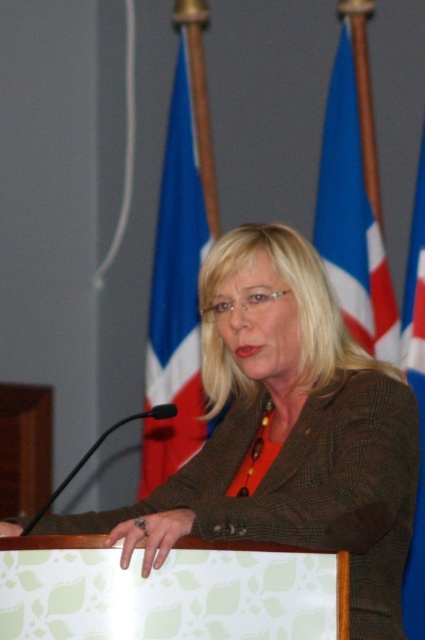
You are a photographer at the event and need to capture a clear shot of the brown textured blazer at center without the blue fabric flag at upper right blocking it. How can you adjust your position to achieve this?

Move closer to the brown textured blazer at center so that it is positioned between you and the blue fabric flag at upper right, ensuring the blazer blocks the view of the flag.

You are a photographer at the event and need to focus your camera on both the brown textured blazer at center and the blue fabric flag at upper right. Given their sizes, which one should you adjust your focus settings for first to ensure clarity?

The brown textured blazer at center has a larger size compared to the blue fabric flag at upper right, so you should focus on the brown textured blazer at center first to ensure clarity due to its larger size.

You are a photographer positioned at a certain distance from the podium. You want to capture a closeup shot of the brown textured blazer at center without moving the camera. Is the current distance sufficient to ensure the blazer fills the frame adequately?

The brown textured blazer at center is 1.78 meters from the camera. To determine if the distance is sufficient, consider the camera lens focal length and sensor size. Without specific equipment details, it is impossible to confirm if the current distance will adequately fill the frame with the blazer.